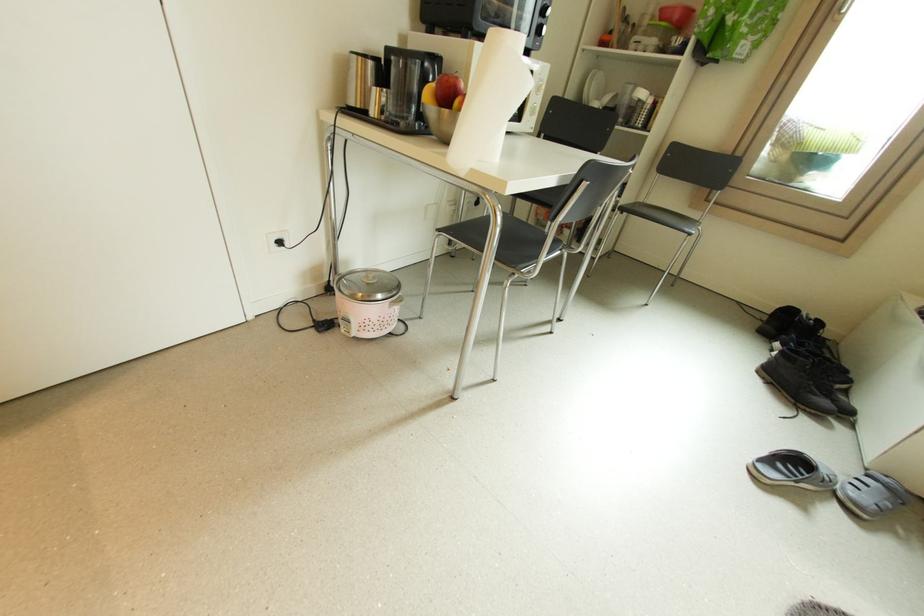
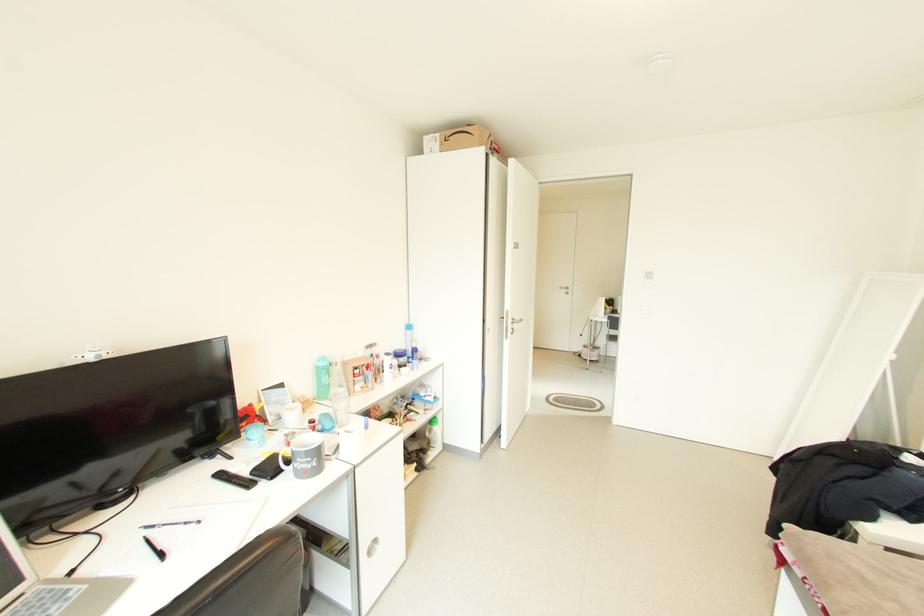
Question: I am providing you with two images of the same scene from different viewpoints. Please identify which objects are invisible in image2.

Choices:
 (A) black remote control
 (B) round cabinet handle
 (C) grey sandal
 (D) black bathroom scale

Answer: (C)